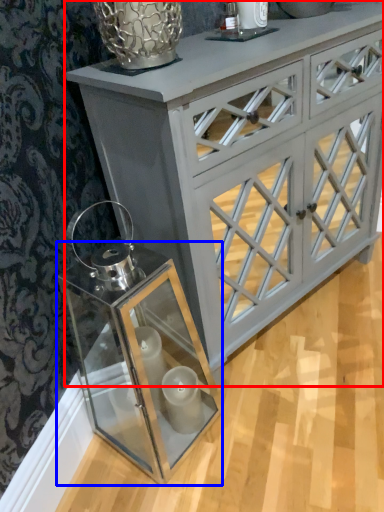
Question: Which object is further to the camera taking this photo, chest of drawers (highlighted by a red box) or glass box (highlighted by a blue box)?

Choices:
 (A) chest of drawers
 (B) glass box

Answer: (A)